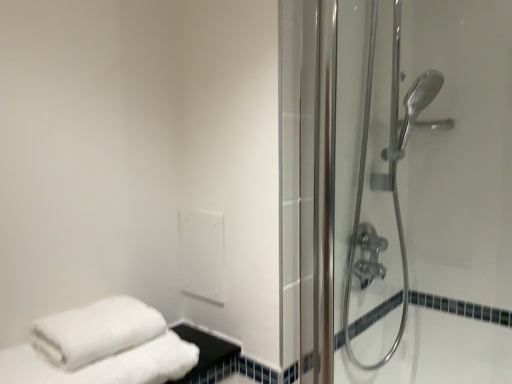
Question: From their relative heights in the image, would you say polished chrome shower door at right, positioned as the second shower door in front-to-back order, is taller or shorter than transparent glass shower door at right, positioned as the 1th shower door in front-to-back order?

Choices:
 (A) tall
 (B) short

Answer: (A)

Question: Is polished chrome shower door at right, which is counted as the 1th shower door, starting from the back, wider or thinner than transparent glass shower door at right, the 2th shower door in the back-to-front sequence?

Choices:
 (A) thin
 (B) wide

Answer: (B)

Question: Does point pos(395,51) appear closer or farther from the camera than point pos(435,102)?

Choices:
 (A) closer
 (B) farther

Answer: (A)

Question: Looking at the image, does transparent glass shower door at right, positioned as the 1th shower door in front-to-back order, seem bigger or smaller compared to polished chrome shower door at right, which is counted as the 1th shower door, starting from the back?

Choices:
 (A) small
 (B) big

Answer: (A)

Question: Considering their positions, is transparent glass shower door at right, positioned as the 1th shower door in front-to-back order, located in front of or behind polished chrome shower door at right, which is counted as the 1th shower door, starting from the back?

Choices:
 (A) behind
 (B) front

Answer: (B)

Question: Considering the positions of point (364, 321) and point (397, 79), is point (364, 321) closer or farther from the camera than point (397, 79)?

Choices:
 (A) farther
 (B) closer

Answer: (B)

Question: Is transparent glass shower door at right, the 2th shower door in the back-to-front sequence, wider or thinner than polished chrome shower door at right, positioned as the second shower door in front-to-back order?

Choices:
 (A) wide
 (B) thin

Answer: (B)